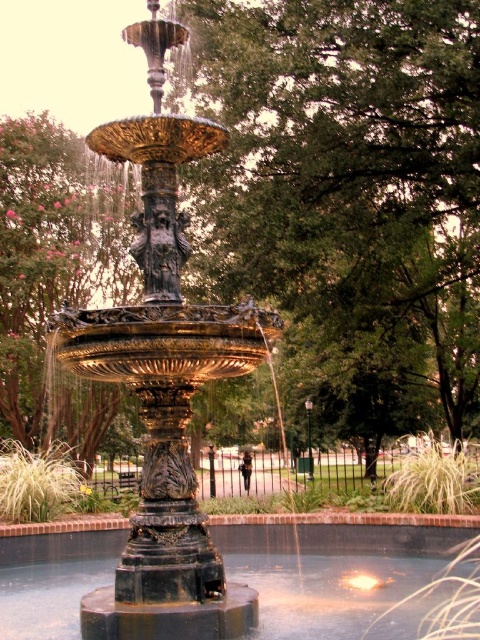
You are standing at the center of the fountain and looking towards the point marked as point [348,195]. What do you see there?

The point [348,195] indicates a green leafy tree at center, so you see a green leafy tree there.

You are a landscape architect designing a new park. You want to place a new statue that requires a base larger than the green leafy tree at center. Can the black polished stone pool at center accommodate the statue? Explain your reasoning based on the scene description.

The green leafy tree at center is larger in size than the black polished stone pool at center. Since the statue requires a base larger than the tree, the black polished stone pool at center is too small to accommodate the statue.

From the picture: You are standing at the edge of the black polished stone pool at center and want to look at the green leafy tree at center. Will you have to look up or down to see the top of the tree?

The green leafy tree at center is much taller than the black polished stone pool at center, so you will have to look up to see the top of the tree.